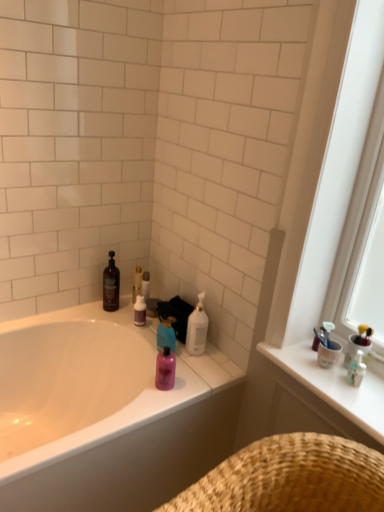
Question: Does blue glossy bottle at center, arranged as the 2th cleaning product when viewed from the right, have a lesser height compared to white glossy counter top at upper right?

Choices:
 (A) no
 (B) yes

Answer: (A)

Question: Is blue glossy bottle at center, which ranks as the second cleaning product in left-to-right order, positioned with its back to white glossy counter top at upper right?

Choices:
 (A) no
 (B) yes

Answer: (A)

Question: Is blue glossy bottle at center, which ranks as the second cleaning product in left-to-right order, positioned in front of white glossy counter top at upper right?

Choices:
 (A) yes
 (B) no

Answer: (B)

Question: Is blue glossy bottle at center, which ranks as the second cleaning product in left-to-right order, thinner than white glossy counter top at upper right?

Choices:
 (A) no
 (B) yes

Answer: (B)

Question: Can you confirm if blue glossy bottle at center, arranged as the 2th cleaning product when viewed from the right, is wider than white glossy counter top at upper right?

Choices:
 (A) no
 (B) yes

Answer: (A)

Question: From the image's perspective, is blue glossy bottle at center, arranged as the 2th cleaning product when viewed from the right, on top of white glossy counter top at upper right?

Choices:
 (A) yes
 (B) no

Answer: (A)

Question: Can you confirm if white matte toilet paper at upper center is shorter than purple matte bottle at center, the third toiletry positioned from the right?

Choices:
 (A) yes
 (B) no

Answer: (A)

Question: Is white matte toilet paper at upper center completely or partially outside of purple matte bottle at center, the third toiletry from the front?

Choices:
 (A) no
 (B) yes

Answer: (B)

Question: Would you say white matte toilet paper at upper center contains purple matte bottle at center, positioned as the 1th toiletry in back-to-front order?

Choices:
 (A) no
 (B) yes

Answer: (A)

Question: From the image's perspective, does white matte toilet paper at upper center appear higher than purple matte bottle at center, the first toiletry viewed from the left?

Choices:
 (A) no
 (B) yes

Answer: (B)

Question: Can you confirm if white matte toilet paper at upper center is wider than purple matte bottle at center, the first toiletry viewed from the left?

Choices:
 (A) no
 (B) yes

Answer: (A)

Question: From a real-world perspective, is white matte toilet paper at upper center below purple matte bottle at center, the third toiletry from the front?

Choices:
 (A) no
 (B) yes

Answer: (A)

Question: Is purple matte bottle at center, the first toiletry viewed from the left, at the right side of blue glossy bottle at center, which ranks as the second cleaning product in left-to-right order?

Choices:
 (A) yes
 (B) no

Answer: (B)